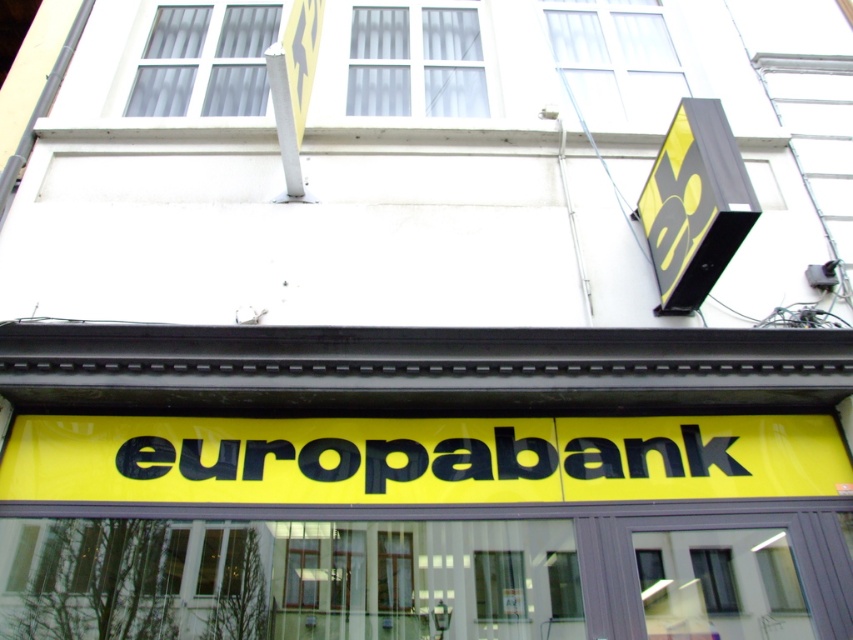
You are standing in front of the Europabank building and want to reach a point that is 4.21 meters away from your current position. Given the coordinates of the point as point (450, 476), can you confirm if this point is located on the building facade?

The point (450, 476) is located on the building facade as it is 4.21 meters away from the viewer, which aligns with the distance provided.